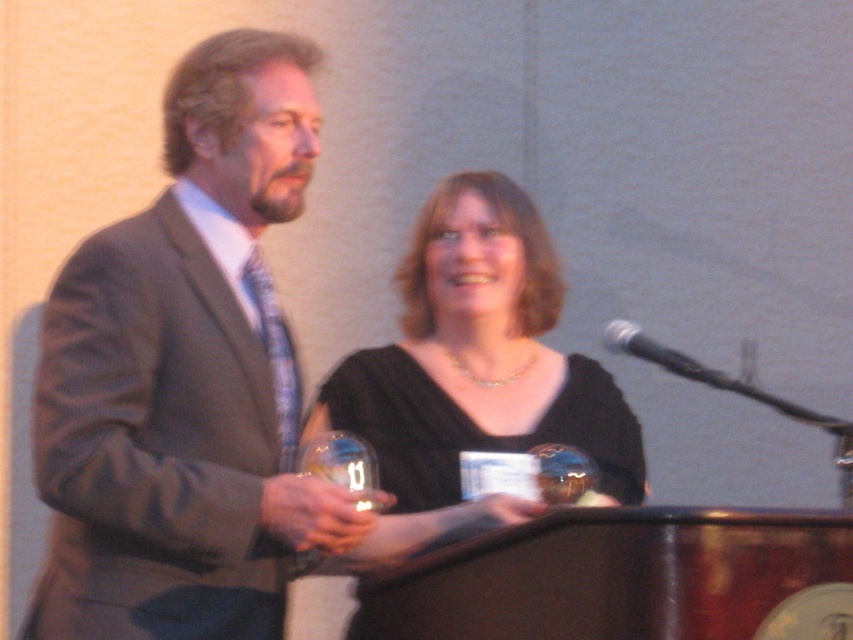
Can you confirm if gray suit at left is bigger than black metallic microphone at center?

Indeed, gray suit at left has a larger size compared to black metallic microphone at center.

Is the position of gray suit at left more distant than that of black metallic microphone at center?

No, it is not.

Between point (228, 312) and point (674, 371), which one is positioned behind?

The point (674, 371) is more distant.

Find the location of a particular element. gray suit at left is located at coordinates (186, 376).

Who is shorter, gray suit at left or black matte dress at center?

black matte dress at center is shorter.

Is gray suit at left closer to camera compared to black matte dress at center?

That is True.

Which is behind, point (157, 296) or point (376, 563)?

The point (376, 563) is more distant.

Find the location of a particular element. The image size is (853, 640). gray suit at left is located at coordinates (186, 376).

Is the position of black matte dress at center more distant than that of black metallic microphone at center?

Yes, black matte dress at center is behind black metallic microphone at center.

Is point (527, 204) more distant than point (724, 378)?

Yes, point (527, 204) is behind point (724, 378).

Locate an element on the screen. This screenshot has height=640, width=853. black matte dress at center is located at coordinates (474, 372).